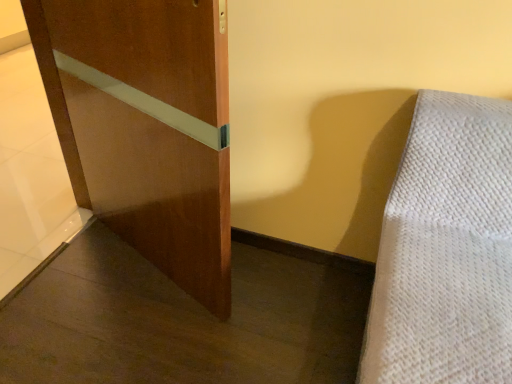
Locate an element on the screen. This screenshot has width=512, height=384. space that is in front of glossy wood door at center is located at coordinates (134, 332).